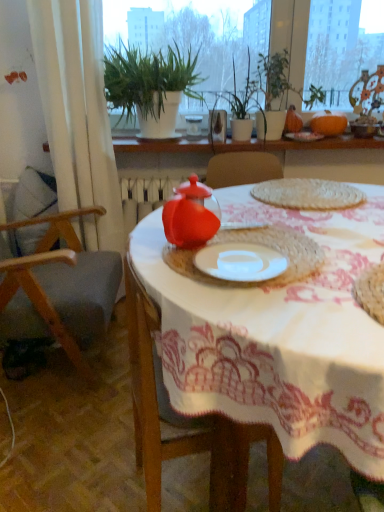
Image resolution: width=384 pixels, height=512 pixels. In order to click on free space to the back side of white matte plate at center in this screenshot , I will do `click(258, 234)`.